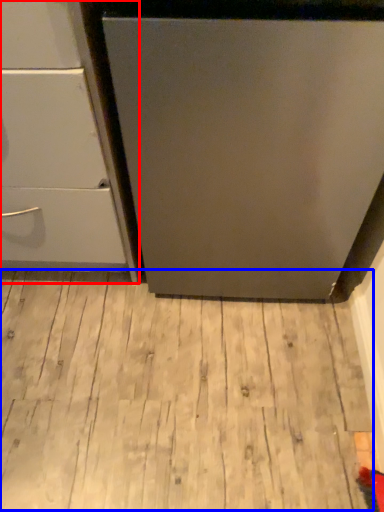
Question: Which of the following is the closest to the observer, chest of drawers (highlighted by a red box) or hardwood (highlighted by a blue box)?

Choices:
 (A) chest of drawers
 (B) hardwood

Answer: (A)